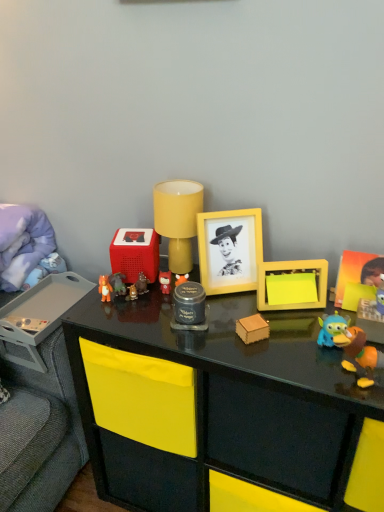
This screenshot has width=384, height=512. I want to click on vacant area situated to the left side of blue rubber duck at right, acting as the 2th toy starting from the right, so click(270, 361).